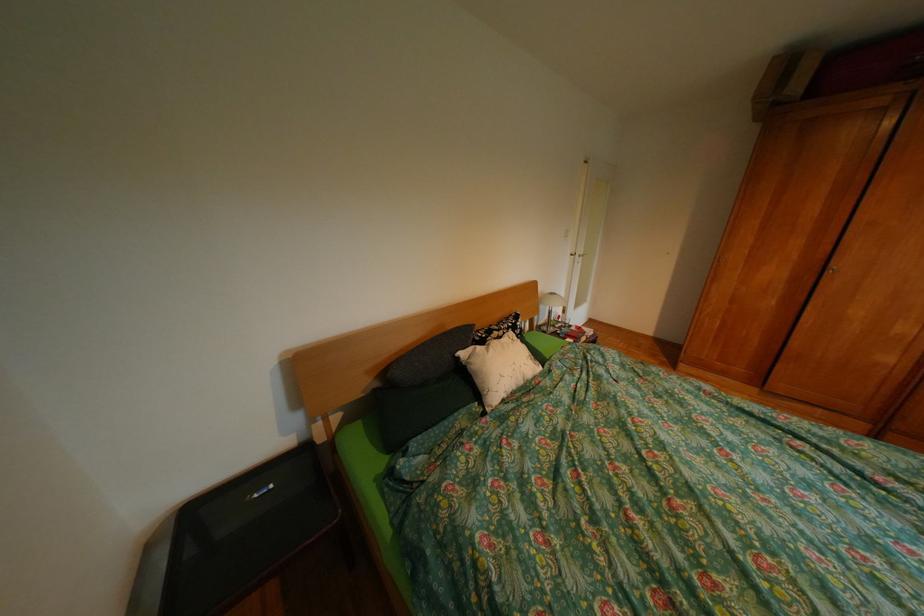
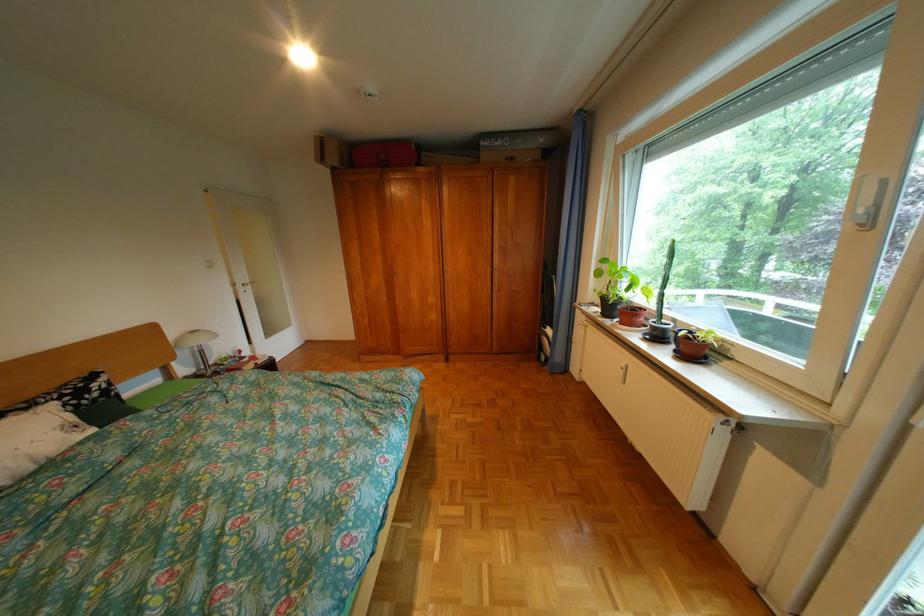
Where in the second image is the point corresponding to point (789, 274) from the first image?

(392, 280)